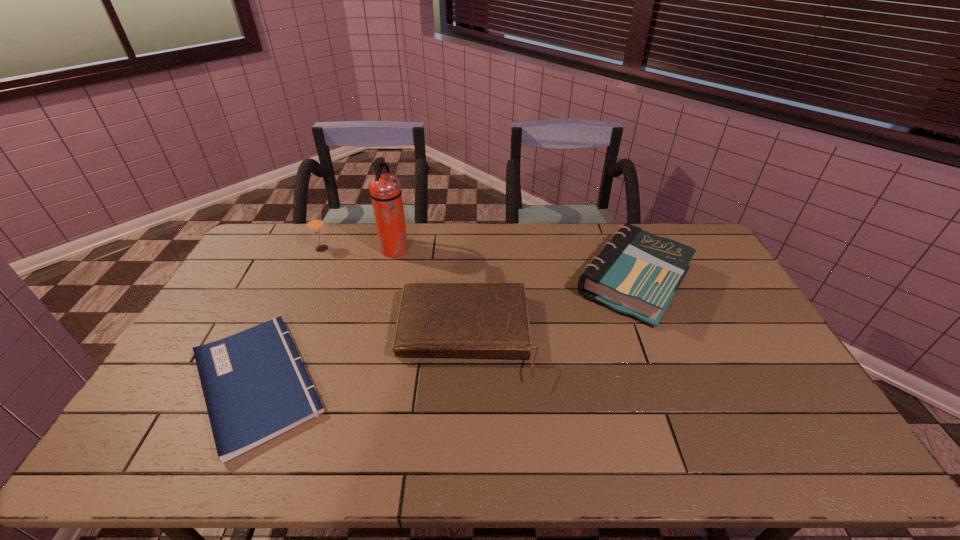
The height and width of the screenshot is (540, 960). Find the location of `vacant area between the shortest paperback book and the third object from left to right`. vacant area between the shortest paperback book and the third object from left to right is located at coordinates (326, 316).

The image size is (960, 540). In order to click on free space between the shortest paperback book and the fourth object from left to right in this screenshot , I will do `click(362, 360)`.

I want to click on vacant region between the rightmost paperback book and the second tallest object, so click(x=478, y=265).

Where is `vacant space in between the shortest paperback book and the third object from right to left`? The width and height of the screenshot is (960, 540). vacant space in between the shortest paperback book and the third object from right to left is located at coordinates (326, 316).

Where is `free space between the shortest object and the fire extinguisher`? The image size is (960, 540). free space between the shortest object and the fire extinguisher is located at coordinates (326, 316).

Choose which object is the third nearest neighbor to the fourth shortest object. Please provide its 2D coordinates. Your answer should be formatted as a tuple, i.e. [(x, y)], where the tuple contains the x and y coordinates of a point satisfying the conditions above.

[(473, 320)]

Image resolution: width=960 pixels, height=540 pixels. I want to click on object that stands as the second closest to the shortest object, so click(x=385, y=189).

Image resolution: width=960 pixels, height=540 pixels. In order to click on paperback book identified as the third closest to the third object from right to left in this screenshot , I will do `click(637, 273)`.

You are a GUI agent. You are given a task and a screenshot of the screen. Output one action in this format:
    pyautogui.click(x=<x>, y=<y>)
    Task: Click on the paperback book object that ranks as the closest to the leftmost paperback book
    Image resolution: width=960 pixels, height=540 pixels.
    Given the screenshot: What is the action you would take?
    pyautogui.click(x=473, y=320)

In order to click on vacant space that satisfies the following two spatial constraints: 1. on the back side of the shortest object; 2. on the left side of the fourth shortest object in this screenshot , I will do `click(319, 248)`.